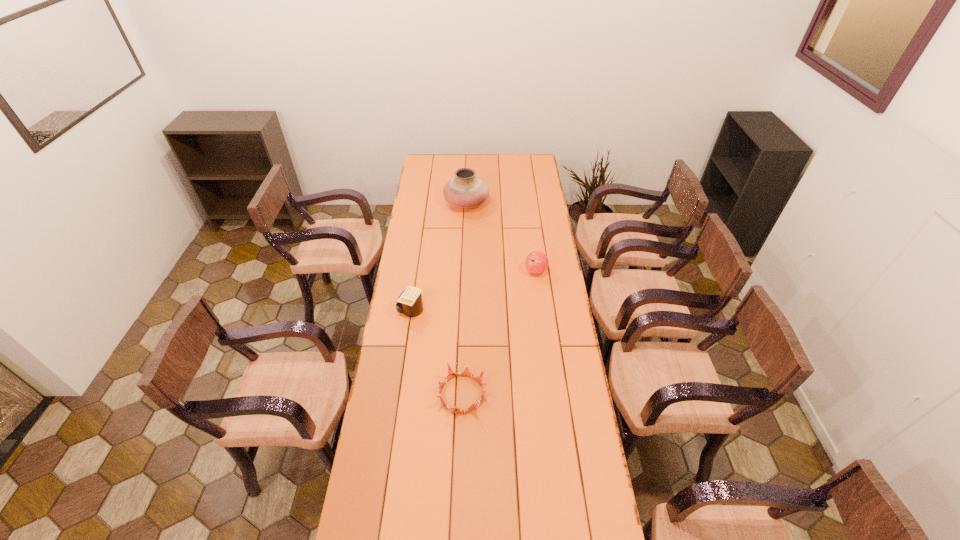
Where is `unoccupied position between the crown and the third nearest object`? The width and height of the screenshot is (960, 540). unoccupied position between the crown and the third nearest object is located at coordinates (499, 333).

The width and height of the screenshot is (960, 540). In order to click on free space between the calculator and the rightmost object in this screenshot , I will do `click(473, 291)`.

Locate an element on the screen. The width and height of the screenshot is (960, 540). empty location between the nearest object and the pottery is located at coordinates (464, 298).

The width and height of the screenshot is (960, 540). In order to click on vacant space that is in between the third nearest object and the pottery in this screenshot , I will do `click(501, 237)`.

I want to click on vacant region between the tallest object and the shortest object, so pyautogui.click(x=464, y=298).

Where is `free space between the farthest object and the rightmost object`? free space between the farthest object and the rightmost object is located at coordinates (501, 237).

What are the coordinates of `vacant area that lies between the pottery and the third farthest object` in the screenshot? It's located at (439, 256).

At what (x,y) coordinates should I click in order to perform the action: click on free space between the farthest object and the rightmost object. Please return your answer as a coordinate pair (x, y). Looking at the image, I should click on (501, 237).

Find the location of `object that stands as the third closest to the nearest object`. object that stands as the third closest to the nearest object is located at coordinates (465, 190).

Where is `object that is the second nearest to the second farthest object`? object that is the second nearest to the second farthest object is located at coordinates (409, 302).